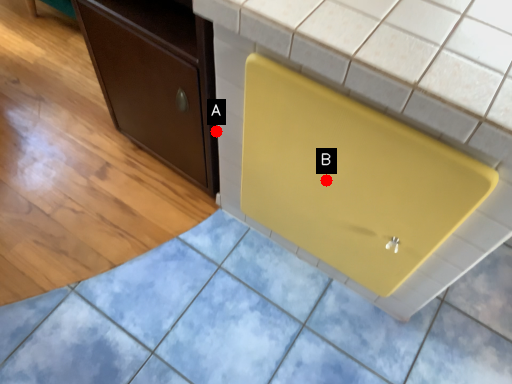
Question: Two points are circled on the image, labeled by A and B beside each circle. Which point is further to the camera?

Choices:
 (A) A is further
 (B) B is further

Answer: (A)